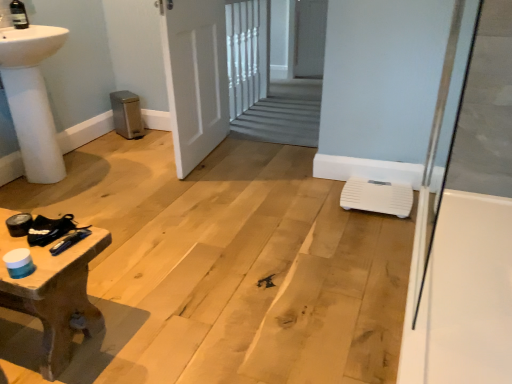
Find the location of a particular element. This screenshot has height=384, width=512. free area in between white matte door at center and wooden textured table at lower left is located at coordinates (152, 223).